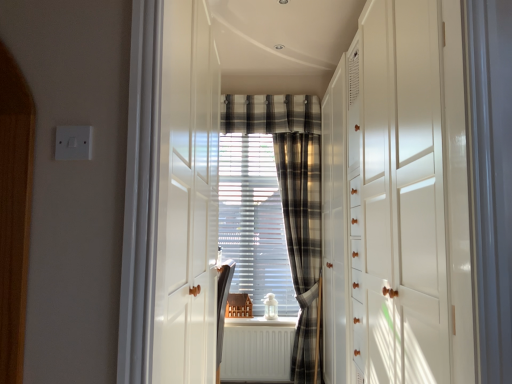
Question: From the image's perspective, would you say white matte radiator at center is shown under plaid fabric curtain at center?

Choices:
 (A) no
 (B) yes

Answer: (B)

Question: Is white matte radiator at center far from plaid fabric curtain at center?

Choices:
 (A) no
 (B) yes

Answer: (A)

Question: Is white matte radiator at center further to camera compared to plaid fabric curtain at center?

Choices:
 (A) no
 (B) yes

Answer: (A)

Question: Is plaid fabric curtain at center a part of white matte radiator at center?

Choices:
 (A) no
 (B) yes

Answer: (A)

Question: Is white matte radiator at center located outside plaid fabric curtain at center?

Choices:
 (A) yes
 (B) no

Answer: (A)

Question: Is white matte radiator at center taller than plaid fabric curtain at center?

Choices:
 (A) no
 (B) yes

Answer: (A)

Question: Considering the relative sizes of plaid fabric curtain at center and plaid fabric at center in the image provided, is plaid fabric curtain at center bigger than plaid fabric at center?

Choices:
 (A) no
 (B) yes

Answer: (B)

Question: Is plaid fabric curtain at center taller than plaid fabric at center?

Choices:
 (A) yes
 (B) no

Answer: (A)

Question: From a real-world perspective, is plaid fabric curtain at center located beneath plaid fabric at center?

Choices:
 (A) no
 (B) yes

Answer: (B)

Question: Can you confirm if plaid fabric curtain at center is positioned to the left of plaid fabric at center?

Choices:
 (A) no
 (B) yes

Answer: (A)

Question: Considering the relative sizes of plaid fabric curtain at center and plaid fabric at center in the image provided, is plaid fabric curtain at center smaller than plaid fabric at center?

Choices:
 (A) yes
 (B) no

Answer: (B)

Question: From the image's perspective, is plaid fabric curtain at center on top of plaid fabric at center?

Choices:
 (A) no
 (B) yes

Answer: (A)

Question: Considering the relative sizes of white glossy dresser at right and white matte radiator at center in the image provided, is white glossy dresser at right smaller than white matte radiator at center?

Choices:
 (A) no
 (B) yes

Answer: (A)